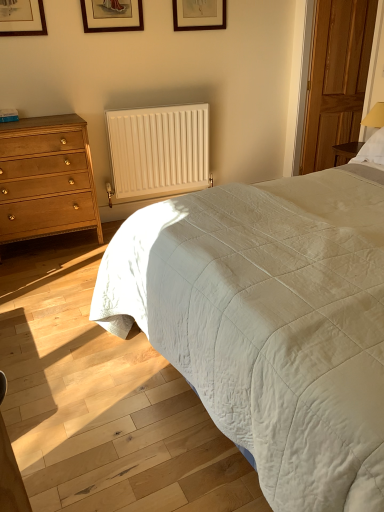
Measure the distance between point (342,54) and camera.

They are 12.08 feet apart.

What do you see at coordinates (337, 78) in the screenshot? The height and width of the screenshot is (512, 384). I see `wooden door at right` at bounding box center [337, 78].

Measure the distance between point (x=136, y=177) and camera.

Point (x=136, y=177) is 3.53 meters from camera.

Where is `wooden picture frame at upper center, which is the 1th picture frame from left to right`? The width and height of the screenshot is (384, 512). wooden picture frame at upper center, which is the 1th picture frame from left to right is located at coordinates (112, 15).

From the image's perspective, would you say matte wood chest of drawers at left is shown under wooden picture frame at upper center, which is counted as the 1th picture frame, starting from the right?

Indeed, from the image's perspective, matte wood chest of drawers at left is shown beneath wooden picture frame at upper center, which is counted as the 1th picture frame, starting from the right.

Can you confirm if matte wood chest of drawers at left is positioned to the right of wooden picture frame at upper center, which ranks as the 1th picture frame in back-to-front order?

Incorrect, matte wood chest of drawers at left is not on the right side of wooden picture frame at upper center, which ranks as the 1th picture frame in back-to-front order.

The width and height of the screenshot is (384, 512). In order to click on chest of drawers on the left of wooden picture frame at upper center, the second picture frame from the front in this screenshot , I will do pos(46,178).

Is matte wood chest of drawers at left oriented towards wooden picture frame at upper center, which is counted as the 1th picture frame, starting from the right?

No, matte wood chest of drawers at left is not oriented towards wooden picture frame at upper center, which is counted as the 1th picture frame, starting from the right.

From the image's perspective, is white matte radiator at center positioned above or below wooden door at right?

white matte radiator at center is situated lower than wooden door at right in the image.

From a real-world perspective, is white matte radiator at center over wooden door at right?

Incorrect, from a real-world perspective, white matte radiator at center is lower than wooden door at right.

Does white matte radiator at center touch wooden door at right?

No.

Is white matte radiator at center in front of or behind wooden door at right in the image?

In the image, white matte radiator at center appears in front of wooden door at right.

Where is `bed lying in front of the matte wood chest of drawers at left`? bed lying in front of the matte wood chest of drawers at left is located at coordinates (270, 323).

Considering the sizes of objects white quilted bed at right and matte wood chest of drawers at left in the image provided, who is wider, white quilted bed at right or matte wood chest of drawers at left?

With larger width is white quilted bed at right.

From the image's perspective, is white quilted bed at right located beneath matte wood chest of drawers at left?

Yes, from the image's perspective, white quilted bed at right is below matte wood chest of drawers at left.

In the scene shown: Is wooden door at right taller than matte wood chest of drawers at left?

Yes, wooden door at right is taller than matte wood chest of drawers at left.

Can you tell me how much wooden door at right and matte wood chest of drawers at left differ in facing direction?

11.7 degrees.

Considering the relative sizes of wooden door at right and matte wood chest of drawers at left in the image provided, is wooden door at right smaller than matte wood chest of drawers at left?

Yes, wooden door at right is smaller than matte wood chest of drawers at left.

Which is more distant, (339, 86) or (42, 199)?

The point (339, 86) is behind.

Is white quilted bed at right facing towards wooden door at right?

No, white quilted bed at right is not turned towards wooden door at right.

Is the depth of white quilted bed at right greater than that of wooden door at right?

→ No, the depth of white quilted bed at right is less than that of wooden door at right.

In the scene shown: Does white quilted bed at right have a lesser width compared to wooden door at right?

No, white quilted bed at right is not thinner than wooden door at right.

Where is `glass door on the right of white quilted bed at right`? glass door on the right of white quilted bed at right is located at coordinates (x=337, y=78).

Measure the distance between wooden picture frame at upper center, which ranks as the 1th picture frame in back-to-front order, and matte wood chest of drawers at left.

wooden picture frame at upper center, which ranks as the 1th picture frame in back-to-front order, and matte wood chest of drawers at left are 1.50 meters apart from each other.

Is wooden picture frame at upper center, acting as the second picture frame starting from the left, situated inside matte wood chest of drawers at left or outside?

wooden picture frame at upper center, acting as the second picture frame starting from the left, exists outside the volume of matte wood chest of drawers at left.

Considering the sizes of wooden picture frame at upper center, which ranks as the 1th picture frame in back-to-front order, and matte wood chest of drawers at left in the image, is wooden picture frame at upper center, which ranks as the 1th picture frame in back-to-front order, taller or shorter than matte wood chest of drawers at left?

Clearly, wooden picture frame at upper center, which ranks as the 1th picture frame in back-to-front order, is shorter compared to matte wood chest of drawers at left.

Considering the positions of point (173, 9) and point (70, 226), is point (173, 9) closer or farther from the camera than point (70, 226)?

Point (173, 9) appears to be farther away from the viewer than point (70, 226).

In terms of height, does matte wood chest of drawers at left look taller or shorter compared to white quilted bed at right?

matte wood chest of drawers at left is taller than white quilted bed at right.

Does matte wood chest of drawers at left touch white quilted bed at right?

No, matte wood chest of drawers at left is not beside white quilted bed at right.

Is matte wood chest of drawers at left inside or outside of white quilted bed at right?

matte wood chest of drawers at left is not enclosed by white quilted bed at right.

Between matte wood chest of drawers at left and white quilted bed at right, which one appears on the left side from the viewer's perspective?

From the viewer's perspective, matte wood chest of drawers at left appears more on the left side.

From a real-world perspective, starting from the matte wood chest of drawers at left, which picture frame is the 2nd one vertically above it? Please provide its 2D coordinates.

[(199, 15)]

The width and height of the screenshot is (384, 512). I want to click on radiator below the wooden door at right (from a real-world perspective), so click(159, 150).

Which object lies further to the anchor point white quilted bed at right, matte wood chest of drawers at left or wooden picture frame at upper center, the second picture frame from the front?

wooden picture frame at upper center, the second picture frame from the front, is positioned further to the anchor white quilted bed at right.

From the picture: Which object lies further to the anchor point wooden door at right, wooden picture frame at upper center, placed as the second picture frame when sorted from back to front, or matte wood chest of drawers at left?

Among the two, matte wood chest of drawers at left is located further to wooden door at right.

Estimate the real-world distances between objects in this image. Which object is closer to wooden picture frame at upper center, which ranks as the 1th picture frame in back-to-front order, wooden picture frame at upper center, placed as the second picture frame when sorted from back to front, or white matte radiator at center?

wooden picture frame at upper center, placed as the second picture frame when sorted from back to front.

Which object lies nearer to the anchor point white quilted bed at right, wooden door at right or wooden picture frame at upper center, which is counted as the 1th picture frame, starting from the right?

Among the two, wooden picture frame at upper center, which is counted as the 1th picture frame, starting from the right, is located nearer to white quilted bed at right.

Considering their positions, is matte wood chest of drawers at left positioned closer to wooden door at right than white matte radiator at center?

Among the two, white matte radiator at center is located nearer to wooden door at right.

Which object lies nearer to the anchor point wooden picture frame at upper center, placed as the second picture frame when sorted from back to front, white quilted bed at right or white matte radiator at center?

The object closer to wooden picture frame at upper center, placed as the second picture frame when sorted from back to front, is white matte radiator at center.

From the image, which object appears to be nearer to wooden picture frame at upper center, placed as the second picture frame when sorted from back to front, wooden door at right or white matte radiator at center?

white matte radiator at center is closer to wooden picture frame at upper center, placed as the second picture frame when sorted from back to front.

Based on their spatial positions, is white quilted bed at right or wooden picture frame at upper center, the second picture frame from the front, further from matte wood chest of drawers at left?

Based on the image, white quilted bed at right appears to be further to matte wood chest of drawers at left.

Locate an element on the screen. The image size is (384, 512). chest of drawers between white quilted bed at right and white matte radiator at center along the z-axis is located at coordinates (46, 178).

You are a GUI agent. You are given a task and a screenshot of the screen. Output one action in this format:
    pyautogui.click(x=<x>, y=<y>)
    Task: Click on the radiator located between wooden picture frame at upper center, placed as the second picture frame when sorted from back to front, and wooden door at right in the left-right direction
    The width and height of the screenshot is (384, 512).
    Given the screenshot: What is the action you would take?
    pyautogui.click(x=159, y=150)

Identify the location of chest of drawers between white quilted bed at right and wooden picture frame at upper center, placed as the second picture frame when sorted from back to front, in the front-back direction. The height and width of the screenshot is (512, 384). [46, 178].

This screenshot has width=384, height=512. In order to click on radiator between white quilted bed at right and wooden door at right from front to back in this screenshot , I will do `click(159, 150)`.